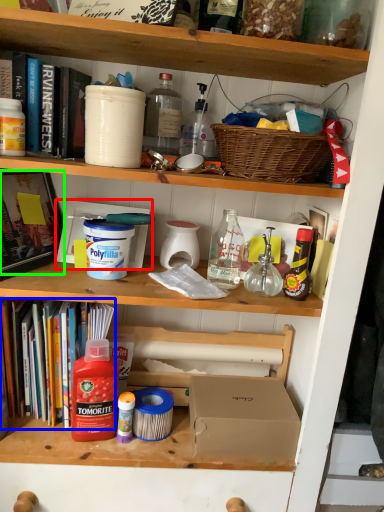
Question: Based on their relative distances, which object is nearer to box (highlighted by a red box)? Choose from book (highlighted by a blue box) and book (highlighted by a green box).

Choices:
 (A) book
 (B) book

Answer: (B)